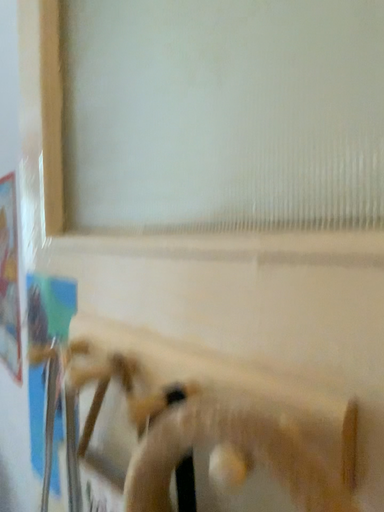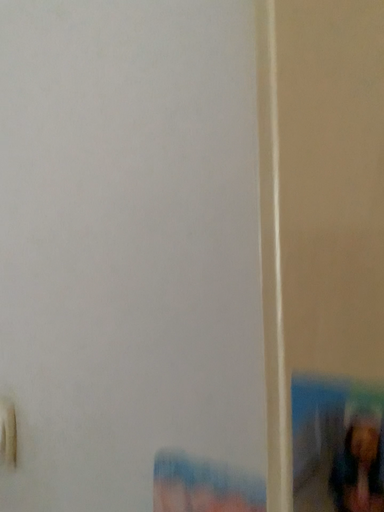
Question: How did the camera likely rotate when shooting the video?

Choices:
 (A) rotated right
 (B) rotated left

Answer: (A)